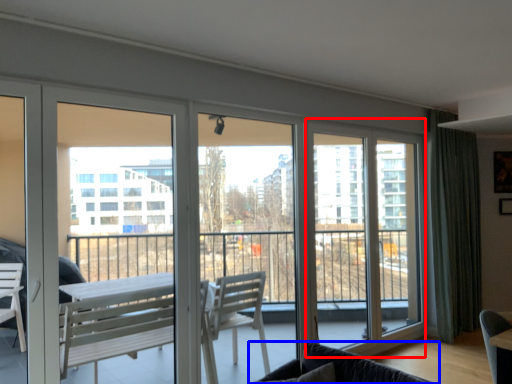
Question: Which of the following is the farthest to the observer, screen door (highlighted by a red box) or studio couch (highlighted by a blue box)?

Choices:
 (A) screen door
 (B) studio couch

Answer: (A)